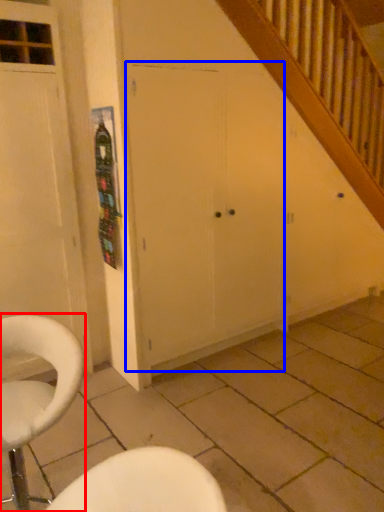
Question: Which object appears closest to the camera in this image, chair (highlighted by a red box) or screen door (highlighted by a blue box)?

Choices:
 (A) chair
 (B) screen door

Answer: (A)